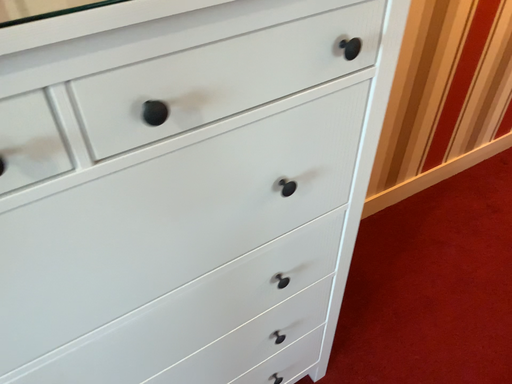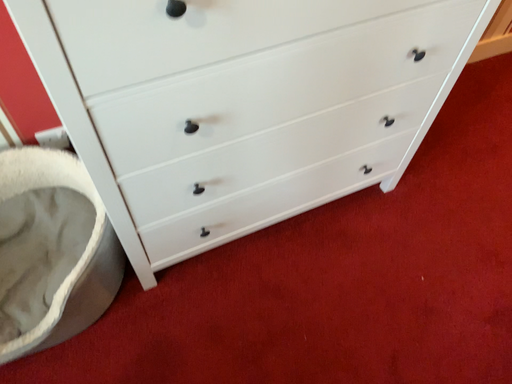
Question: Which way did the camera rotate in the video?

Choices:
 (A) rotated upward
 (B) rotated downward

Answer: (B)